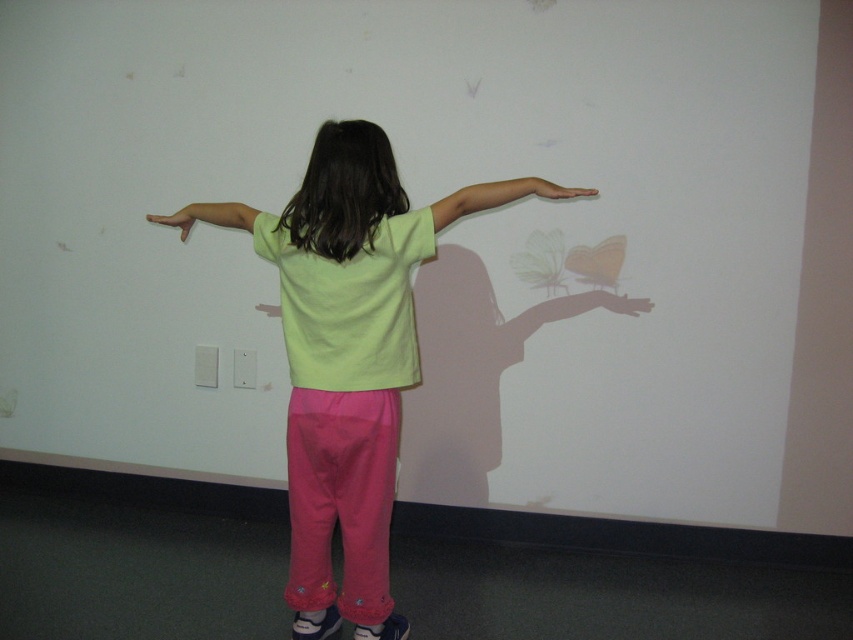
Consider the image. Which is more to the right, light green t-shirt at center or pink matte hand at upper right?

From the viewer's perspective, pink matte hand at upper right appears more on the right side.

Does point (318, 536) lie in front of point (556, 186)?

No, it is behind (556, 186).

You are a GUI agent. You are given a task and a screenshot of the screen. Output one action in this format:
    pyautogui.click(x=<x>, y=<y>)
    Task: Click on the light green t-shirt at center
    The width and height of the screenshot is (853, 640).
    Given the screenshot: What is the action you would take?
    (347, 358)

Find the location of `light green t-shirt at center`. light green t-shirt at center is located at coordinates (347, 358).

In the scene shown: Who is taller, light green t-shirt at center or matte black hand at center?

light green t-shirt at center is taller.

Is point (325, 632) less distant than point (618, 301)?

Yes, point (325, 632) is closer to viewer.

Where is `light green t-shirt at center`? light green t-shirt at center is located at coordinates pyautogui.click(x=347, y=358).

What do you see at coordinates (347, 358) in the screenshot? This screenshot has height=640, width=853. I see `light green t-shirt at center` at bounding box center [347, 358].

Does light green t-shirt at center appear under matte yellow hand at left?

Yes, light green t-shirt at center is below matte yellow hand at left.

Does point (497, 198) come farther from viewer compared to point (206, 208)?

That is False.

This screenshot has width=853, height=640. In order to click on light green t-shirt at center in this screenshot , I will do `click(347, 358)`.